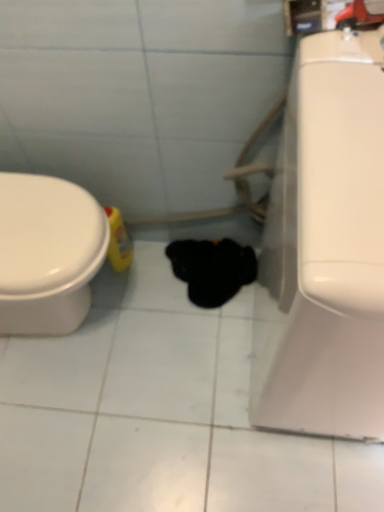
Question: Is black fuzzy cat at center completely or partially outside of white glossy toilet at right?

Choices:
 (A) no
 (B) yes

Answer: (B)

Question: Is black fuzzy cat at center positioned with its back to white glossy toilet at right?

Choices:
 (A) yes
 (B) no

Answer: (B)

Question: Does black fuzzy cat at center lie behind white glossy toilet at right?

Choices:
 (A) no
 (B) yes

Answer: (B)

Question: Does black fuzzy cat at center turn towards white glossy toilet at right?

Choices:
 (A) yes
 (B) no

Answer: (B)

Question: Is black fuzzy cat at center thinner than white glossy toilet at right?

Choices:
 (A) no
 (B) yes

Answer: (B)

Question: Is the position of black fuzzy cat at center less distant than that of white glossy toilet at right?

Choices:
 (A) no
 (B) yes

Answer: (A)

Question: Is white glossy toilet at right not within black fuzzy cat at center?

Choices:
 (A) no
 (B) yes

Answer: (B)

Question: Considering the relative sizes of white glossy toilet at right and black fuzzy cat at center in the image provided, is white glossy toilet at right thinner than black fuzzy cat at center?

Choices:
 (A) no
 (B) yes

Answer: (A)

Question: Is black fuzzy cat at center completely or partially inside white glossy toilet at right?

Choices:
 (A) yes
 (B) no

Answer: (B)

Question: Does white glossy toilet at right have a larger size compared to black fuzzy cat at center?

Choices:
 (A) no
 (B) yes

Answer: (B)

Question: Does white glossy toilet at right have a smaller size compared to black fuzzy cat at center?

Choices:
 (A) yes
 (B) no

Answer: (B)

Question: Considering the relative sizes of white glossy toilet at right and black fuzzy cat at center in the image provided, is white glossy toilet at right shorter than black fuzzy cat at center?

Choices:
 (A) yes
 (B) no

Answer: (B)

Question: Is black fuzzy cat at center situated inside white glossy toilet at right or outside?

Choices:
 (A) outside
 (B) inside

Answer: (A)